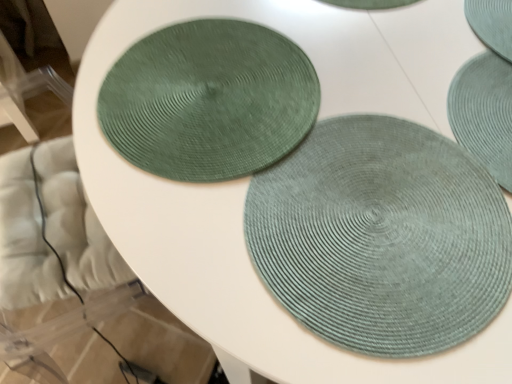
The image size is (512, 384). Find the location of `free space that is in between sage green woven mat at center, positioned as the 1th mat in back-to-front order, and teal woven coaster at upper right, positioned as the 2th coaster in left-to-right order`. free space that is in between sage green woven mat at center, positioned as the 1th mat in back-to-front order, and teal woven coaster at upper right, positioned as the 2th coaster in left-to-right order is located at coordinates (442, 57).